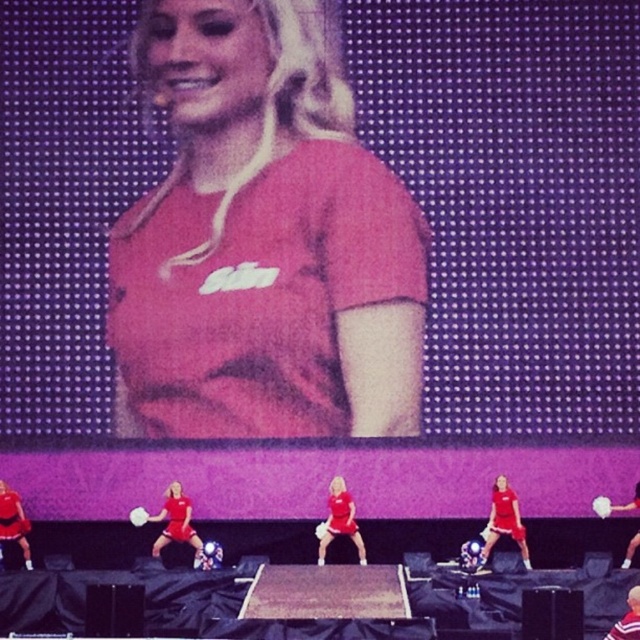
Question: Is matte red shorts at lower right smaller than matte red shorts at center?

Choices:
 (A) yes
 (B) no

Answer: (A)

Question: Which point appears closest to the camera in this image?

Choices:
 (A) (490, 524)
 (B) (3, 536)
 (C) (179, 496)

Answer: (A)

Question: Based on their relative distances, which object is nearer to the matte red shorts at lower right?

Choices:
 (A) matte pink shirt at center
 (B) matte red shorts at lower left
 (C) matte red shorts at center
 (D) matte red shorts at lower center

Answer: (C)

Question: Does matte red shorts at lower right have a greater width compared to matte red shorts at lower left?

Choices:
 (A) no
 (B) yes

Answer: (A)

Question: Which of these objects is positioned closest to the matte red shorts at lower right?

Choices:
 (A) matte pink shirt at center
 (B) matte red shorts at lower center
 (C) matte red shorts at center

Answer: (C)

Question: Can you confirm if matte pink shirt at center is bigger than matte red shorts at lower left?

Choices:
 (A) no
 (B) yes

Answer: (B)